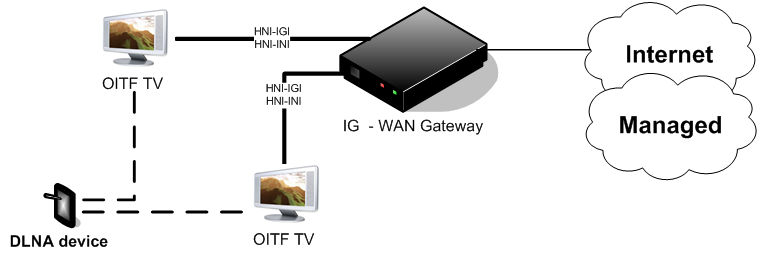
I want to click on router icon, so click(x=411, y=63).